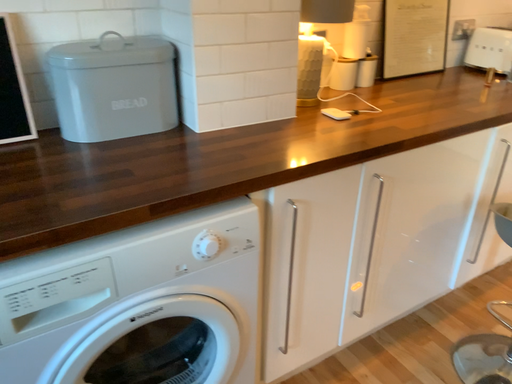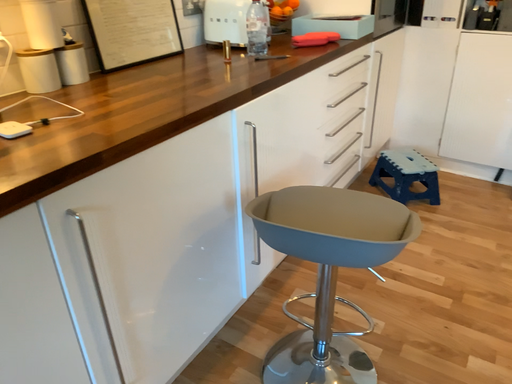
Question: Which way did the camera rotate in the video?

Choices:
 (A) rotated left
 (B) rotated right

Answer: (B)